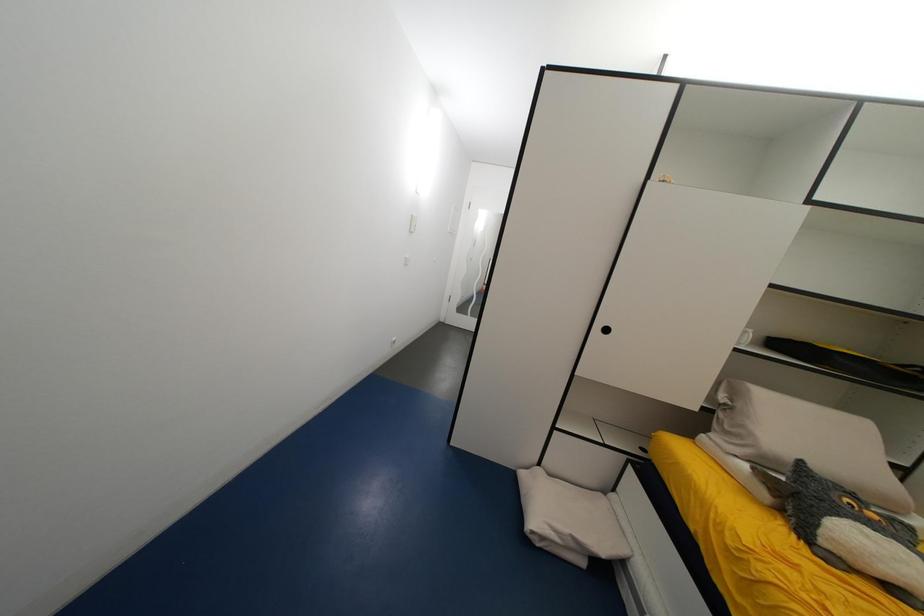
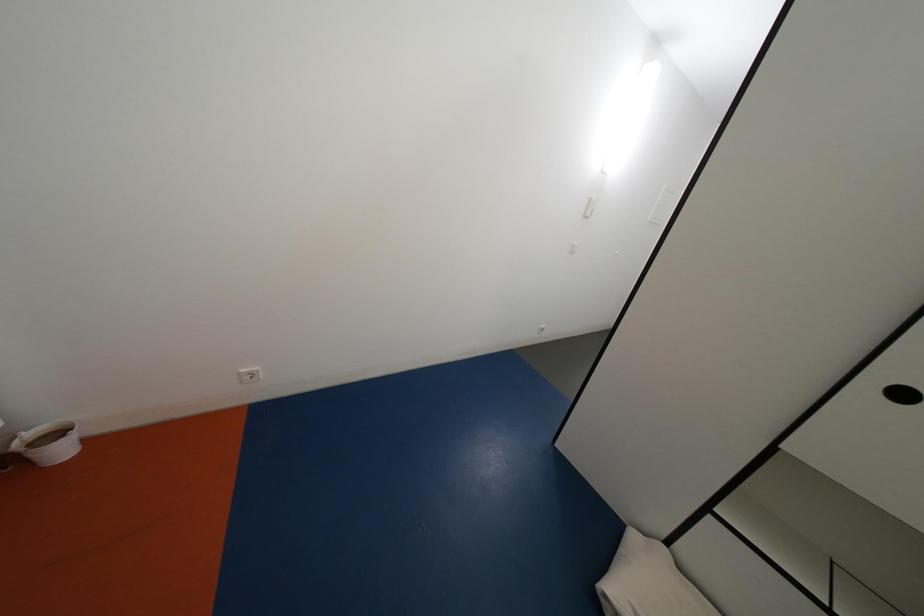
Question: How did the camera likely rotate?

Choices:
 (A) Left
 (B) Right
 (C) Up
 (D) Down

Answer: (A)